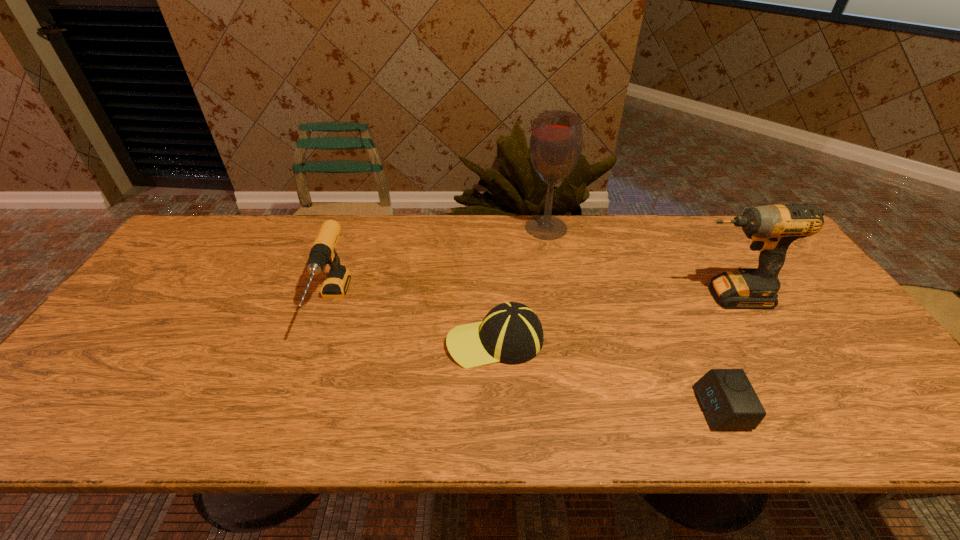
I want to click on object positioned at the far edge, so click(555, 147).

Locate an element on the screen. The image size is (960, 540). object that is positioned at the near edge is located at coordinates (729, 402).

At what (x,y) coordinates should I click in order to perform the action: click on object located in the right edge section of the desktop. Please return your answer as a coordinate pair (x, y). This screenshot has height=540, width=960. Looking at the image, I should click on click(772, 228).

The height and width of the screenshot is (540, 960). Find the location of `free space at the far edge of the desktop`. free space at the far edge of the desktop is located at coordinates (455, 226).

Image resolution: width=960 pixels, height=540 pixels. I want to click on vacant space at the near edge, so click(x=318, y=415).

This screenshot has width=960, height=540. I want to click on free point at the left edge, so click(x=158, y=288).

Identify the location of vacant space at the right edge. This screenshot has height=540, width=960. (876, 393).

The width and height of the screenshot is (960, 540). I want to click on vacant space at the far right corner, so click(719, 226).

You are a GUI agent. You are given a task and a screenshot of the screen. Output one action in this format:
    pyautogui.click(x=<x>, y=<y>)
    Task: Click on the free spot between the baseball cap and the farthest object
    The image size is (960, 540).
    Given the screenshot: What is the action you would take?
    pyautogui.click(x=520, y=284)

At what (x,y) coordinates should I click in order to perform the action: click on free space between the leftmost object and the fourth shortest object. Please return your answer as a coordinate pair (x, y). The width and height of the screenshot is (960, 540). Looking at the image, I should click on (530, 300).